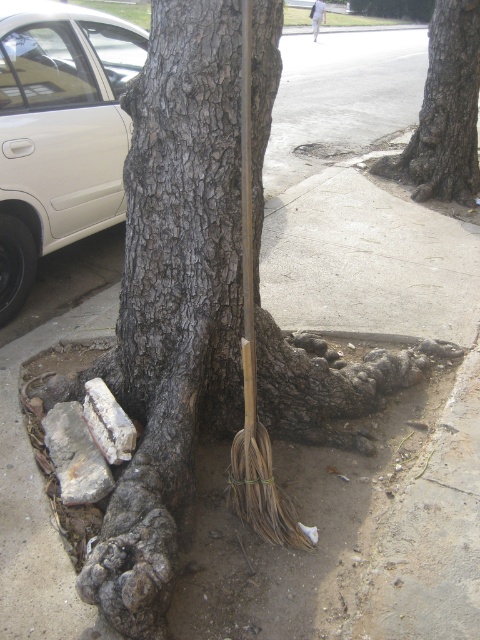
Who is higher up, white matte car at left or rough bark tree at upper right?

rough bark tree at upper right

Based on the photo, between white matte car at left and rough bark tree at upper right, which one has more height?

white matte car at left

Measure the distance between white matte car at left and camera.

3.06 meters

Locate an element on the screen. This screenshot has height=640, width=480. white matte car at left is located at coordinates (60, 131).

Is rough bark tree at upper right wider than white fabric at upper center?

Indeed, rough bark tree at upper right has a greater width compared to white fabric at upper center.

Does rough bark tree at upper right appear over white fabric at upper center?

No, rough bark tree at upper right is not above white fabric at upper center.

This screenshot has width=480, height=640. I want to click on rough bark tree at upper right, so click(444, 109).

Is white matte car at left to the right of white fabric at upper center from the viewer's perspective?

Incorrect, white matte car at left is not on the right side of white fabric at upper center.

Does white matte car at left appear on the left side of white fabric at upper center?

Correct, you'll find white matte car at left to the left of white fabric at upper center.

Who is more forward, [105,35] or [320,4]?

Point [105,35] is in front.

You are a GUI agent. You are given a task and a screenshot of the screen. Output one action in this format:
    pyautogui.click(x=<x>, y=<y>)
    Task: Click on the white matte car at left
    
    Given the screenshot: What is the action you would take?
    pyautogui.click(x=60, y=131)